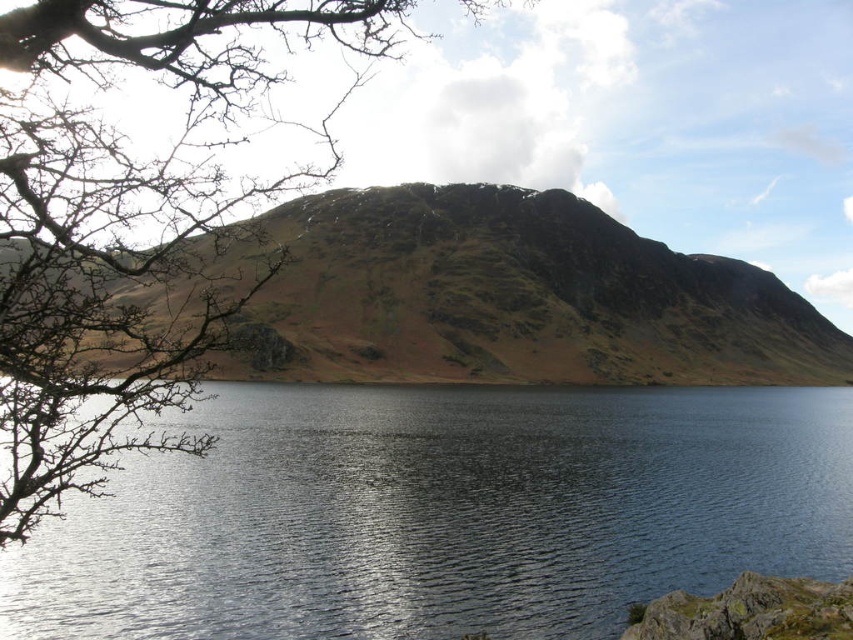
Between blue reflective water at center and bare branches at left, which one appears on the right side from the viewer's perspective?

From the viewer's perspective, blue reflective water at center appears more on the right side.

Locate an element on the screen. This screenshot has height=640, width=853. blue reflective water at center is located at coordinates (444, 513).

Can you confirm if blue reflective water at center is smaller than brown rocky mountain at upper center?

Correct, blue reflective water at center occupies less space than brown rocky mountain at upper center.

Who is higher up, blue reflective water at center or brown rocky mountain at upper center?

brown rocky mountain at upper center

Does point (433, 604) come farther from viewer compared to point (511, 296)?

No, (433, 604) is in front of (511, 296).

Find the location of a particular element. blue reflective water at center is located at coordinates (444, 513).

Can you confirm if bare branches at left is positioned below brown rocky mountain at upper center?

Incorrect, bare branches at left is not positioned below brown rocky mountain at upper center.

Is point (88, 74) positioned before point (721, 369)?

Yes.

Is point (161, 262) less distant than point (447, 224)?

Yes, it is in front of point (447, 224).

Locate an element on the screen. bare branches at left is located at coordinates (126, 221).